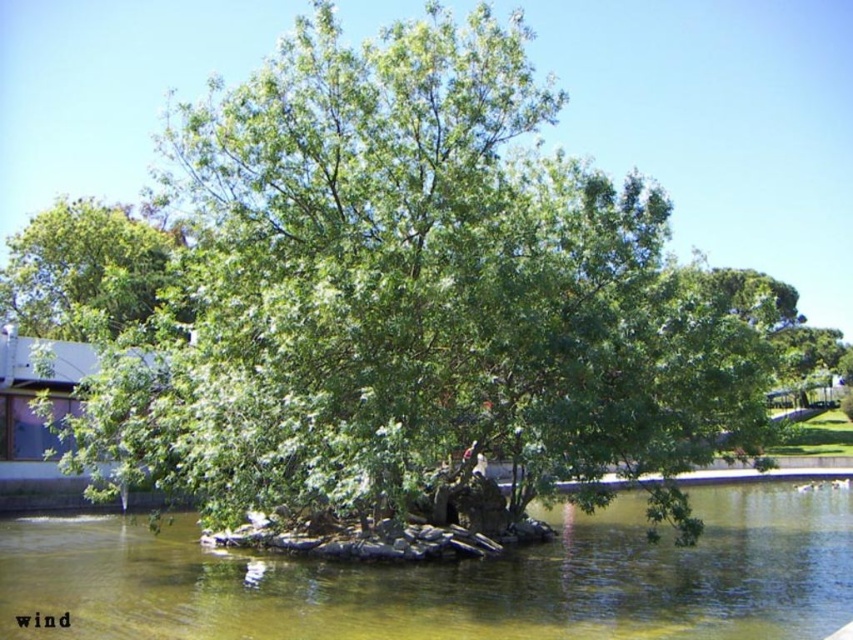
Between greenish-brown water at center and green leafy tree at upper left, which one has less height?

greenish-brown water at center

Does greenish-brown water at center have a lesser width compared to green leafy tree at upper left?

No.

Locate an element on the screen. greenish-brown water at center is located at coordinates (453, 579).